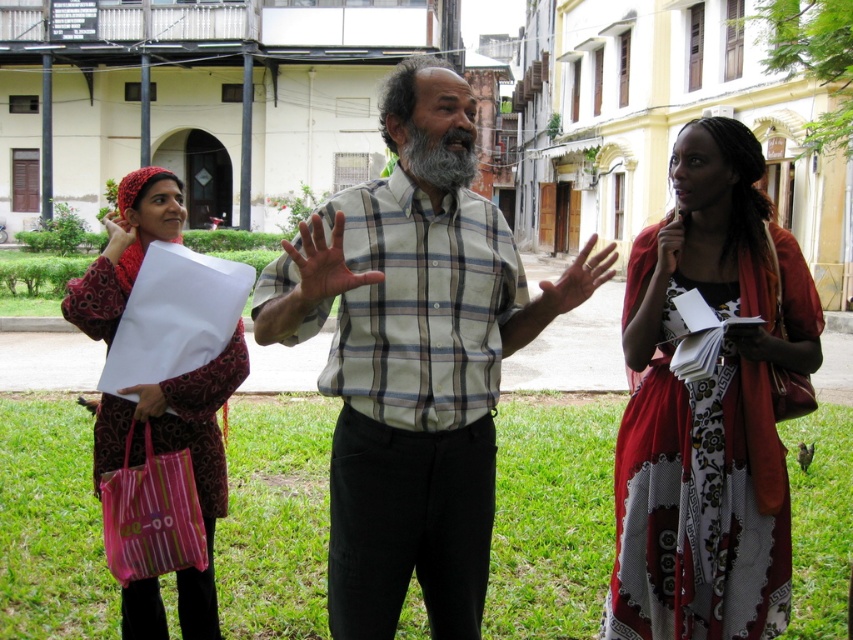
You are a delivery person who needs to place a 70 cm wide package between the light beige plaid shirt at center and the pink striped fabric shopping bag at lower left. Can you fit the package in the space between them?

The distance between the light beige plaid shirt at center and the pink striped fabric shopping bag at lower left is 69.25 centimeters. Since the package is 70 cm wide, it is slightly wider than the available space, so the package cannot fit between them.

You are a photographer trying to capture a closeup of both the matte red scarf at left and the pink striped fabric shopping bag at lower left in the scene. Given that your camera has a maximum focus range of 4 inches, will you be able to capture both items in focus without moving the camera?

The matte red scarf at left and pink striped fabric shopping bag at lower left are 4.47 inches apart from each other. Since the distance between them exceeds the camera maximum focus range of 4 inches, you will not be able to capture both items in focus without moving the camera.

You are a fashion designer observing the scene. You notice the matte red scarf at left and the pink striped fabric shopping bag at lower left. Which item is covering part of the other?

The matte red scarf at left is positioned over the pink striped fabric shopping bag at lower left, so the scarf is covering part of the bag.